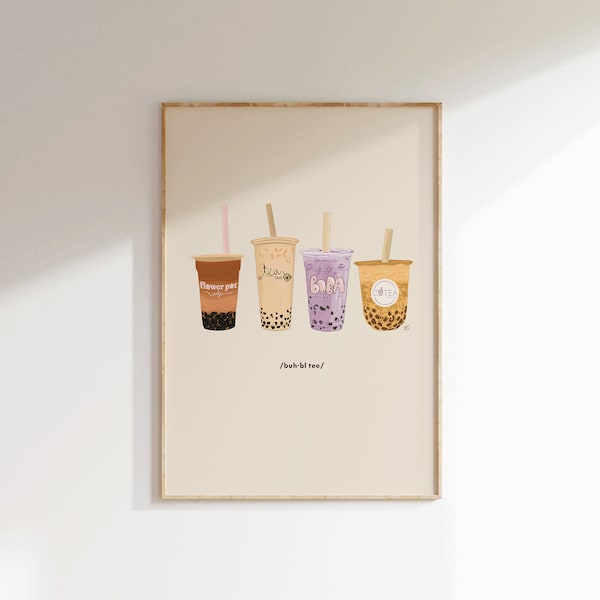
At what (x,y) coordinates should I click in order to perform the action: click on frame. Please return your answer as a coordinate pair (x, y). The width and height of the screenshot is (600, 600). Looking at the image, I should click on (440, 462).